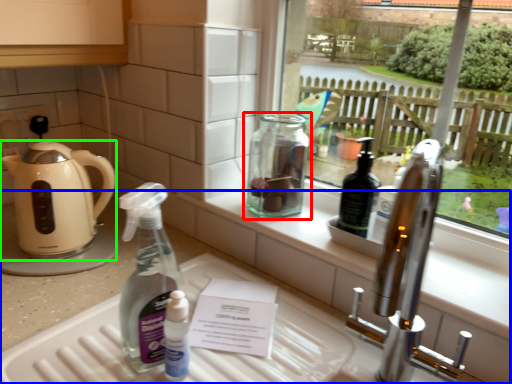
Question: Based on their relative distances, which object is farther from bottle (highlighted by a red box)? Choose from counter (highlighted by a blue box) and kettle (highlighted by a green box).

Choices:
 (A) counter
 (B) kettle

Answer: (B)